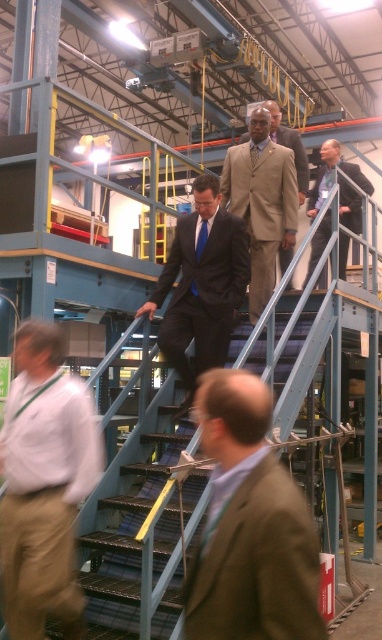
Question: From the image, what is the correct spatial relationship of brown suit at center in relation to blue metal stairs at center?

Choices:
 (A) below
 (B) above

Answer: (B)

Question: Does light beige pants at lower left appear over matte black suit at center?

Choices:
 (A) no
 (B) yes

Answer: (A)

Question: Which point is farther to the camera?

Choices:
 (A) (278, 106)
 (B) (95, 579)
 (C) (61, 426)
 (D) (284, 476)

Answer: (A)

Question: Which point is closer to the camera taking this photo?

Choices:
 (A) (124, 573)
 (B) (281, 272)
 (C) (252, 600)

Answer: (C)

Question: Can you confirm if brown suit at center is smaller than matte black suit at center?

Choices:
 (A) no
 (B) yes

Answer: (B)

Question: Which point is closer to the camera taking this photo?

Choices:
 (A) (194, 289)
 (B) (331, 179)
 (C) (276, 148)

Answer: (A)